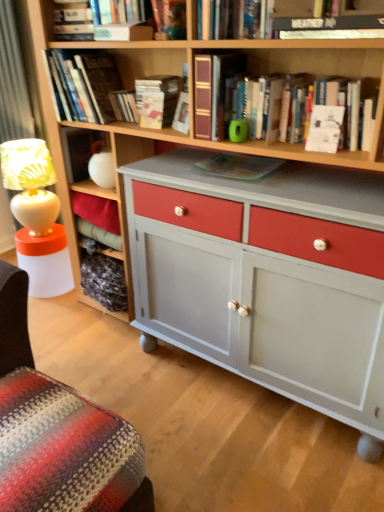
Question: Is hardcover book at upper left, positioned as the sixth book in right-to-left order, closer to camera compared to matte paper at upper center, positioned as the 3th paperback book in right-to-left order?

Choices:
 (A) yes
 (B) no

Answer: (A)

Question: Can you confirm if hardcover book at upper left, which is counted as the second book, starting from the left, is wider than matte paper at upper center, the second paperback book viewed from the back?

Choices:
 (A) no
 (B) yes

Answer: (B)

Question: Is hardcover book at upper left, which is counted as the second book, starting from the left, positioned with its back to matte paper at upper center, positioned as the 3th paperback book in right-to-left order?

Choices:
 (A) yes
 (B) no

Answer: (B)

Question: Can you confirm if hardcover book at upper left, which is counted as the second book, starting from the left, is positioned to the left of matte paper at upper center, positioned as the 3th paperback book in right-to-left order?

Choices:
 (A) no
 (B) yes

Answer: (B)

Question: Is hardcover book at upper left, which is counted as the second book, starting from the left, shorter than matte paper at upper center, which is counted as the 2th paperback book, starting from the left?

Choices:
 (A) yes
 (B) no

Answer: (B)

Question: From the image's perspective, is hardcover book at upper left, positioned as the sixth book in right-to-left order, on matte paper at upper center, the second paperback book viewed from the back?

Choices:
 (A) yes
 (B) no

Answer: (A)

Question: From a real-world perspective, is matte green paperback book at center, the third paperback book in the back-to-front sequence, beneath white paper at upper center, which is counted as the 4th paperback book, starting from the back?

Choices:
 (A) no
 (B) yes

Answer: (B)

Question: Does matte green paperback book at center, the third paperback book in the back-to-front sequence, have a lesser width compared to white paper at upper center, the 1th paperback book viewed from the right?

Choices:
 (A) yes
 (B) no

Answer: (B)

Question: Does matte green paperback book at center, the 3th paperback book from the left, have a greater height compared to white paper at upper center, the 1th paperback book viewed from the right?

Choices:
 (A) no
 (B) yes

Answer: (A)

Question: From the image's perspective, does matte green paperback book at center, the third paperback book in the back-to-front sequence, appear lower than white paper at upper center, the 1th paperback book viewed from the right?

Choices:
 (A) no
 (B) yes

Answer: (B)

Question: Are matte green paperback book at center, the 3th paperback book from the left, and white paper at upper center, which is counted as the 4th paperback book, starting from the back, located far from each other?

Choices:
 (A) no
 (B) yes

Answer: (A)

Question: Can you confirm if matte green paperback book at center, the 3th paperback book from the left, is positioned to the right of white paper at upper center, the fourth paperback book in the left-to-right sequence?

Choices:
 (A) yes
 (B) no

Answer: (B)

Question: From a real-world perspective, is hardcover book at upper center, the 2th book in the right-to-left sequence, on matte paper book at upper center, the fourth book when ordered from left to right?

Choices:
 (A) yes
 (B) no

Answer: (A)